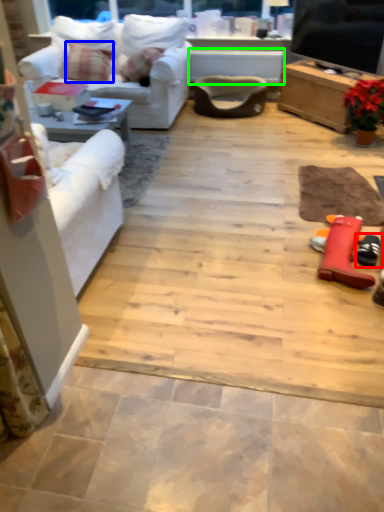
Question: Considering the real-world distances, which object is farthest from footwear (highlighted by a red box)? pillow (highlighted by a blue box) or table (highlighted by a green box)?

Choices:
 (A) pillow
 (B) table

Answer: (A)